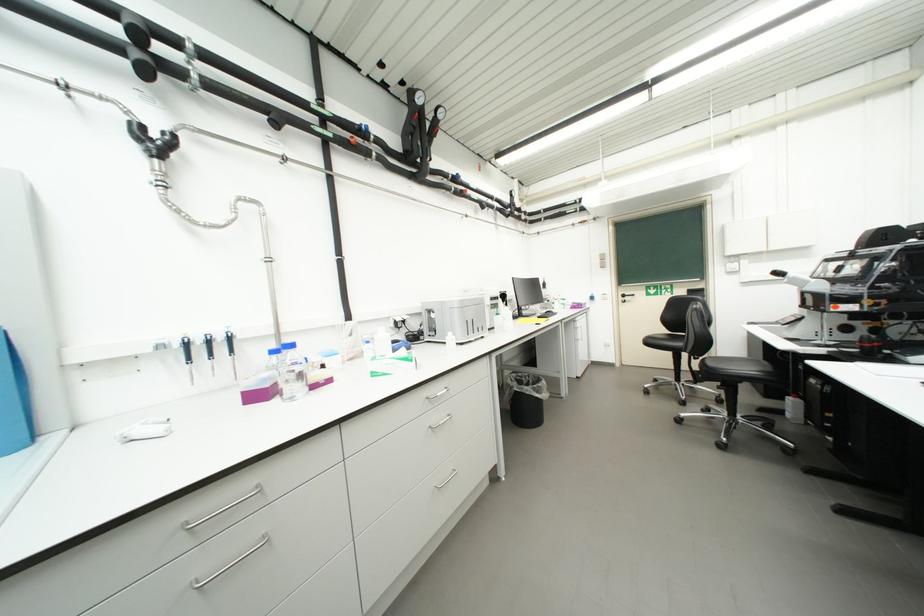
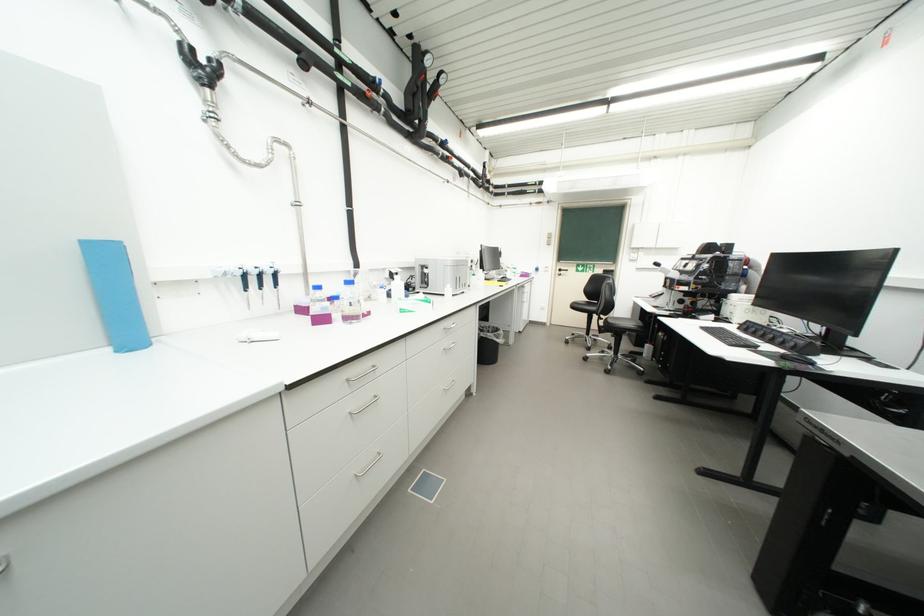
Find the pixel in the second image that matches point 399,326 in the first image.

(395, 277)